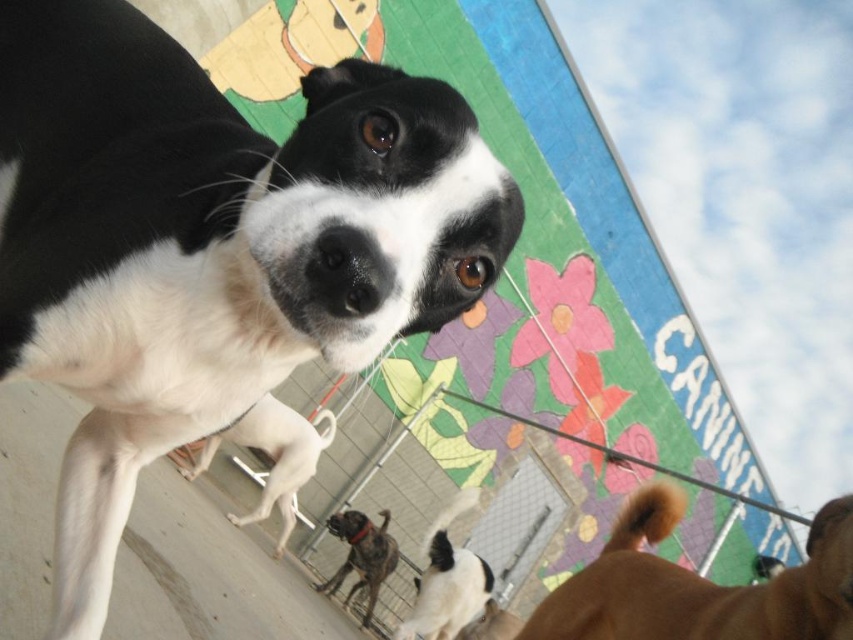
You are holding a 12 inch long measuring tape and want to measure the distance from your current position to the point at coordinates point (x=354, y=278). Can you reach it with your measuring tape?

The distance between point (x=354, y=278) and the camera is 21.93 inches. Since the measuring tape is only 12 inches long, you cannot reach the point with it.

You are a photographer trying to capture the white smooth dog at center and the brown fur tail at lower right in a single frame. Based on their sizes, which one would you need to zoom in more on to get a clear closeup?

The brown fur tail at lower right is smaller than the white smooth dog at center, so you would need to zoom in more on the brown fur tail at lower right to get a clear closeup.

You are a photographer trying to capture the perfect shot of the black matte nose at center and the brindle fur dog at center. Based on their positions, which one should you focus on first to ensure both are in sharp focus?

The black matte nose at center is positioned over the brindle fur dog at center, so focusing on the black matte nose at center first will ensure both are in sharp focus as it is closer to the camera.